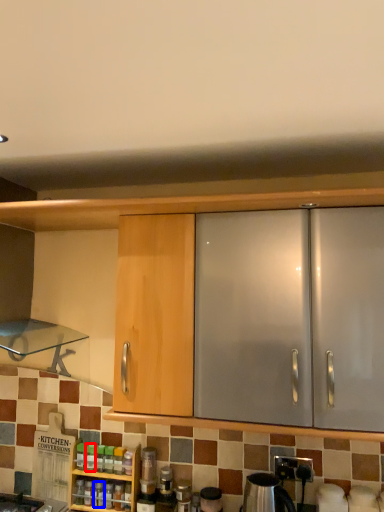
Question: Which point is closer to the camera, bottle (highlighted by a red box) or bottle (highlighted by a blue box)?

Choices:
 (A) bottle
 (B) bottle

Answer: (B)